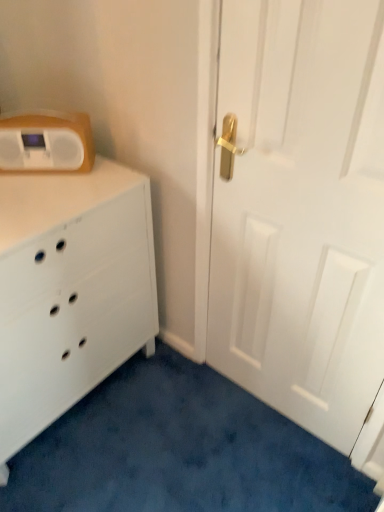
Describe the element at coordinates (70, 291) in the screenshot. I see `white matte chest of drawers at left` at that location.

What are the coordinates of `matte white radio at upper left` in the screenshot? It's located at (46, 143).

Could you tell me if matte white radio at upper left is turned towards white matte door at right?

No, matte white radio at upper left is not facing towards white matte door at right.

Is matte white radio at upper left positioned before white matte door at right?

No, it is not.

In the scene shown: Would you say matte white radio at upper left is inside or outside white matte door at right?

matte white radio at upper left exists outside the volume of white matte door at right.

Is white matte chest of drawers at left positioned before matte white radio at upper left?

Yes, white matte chest of drawers at left is in front of matte white radio at upper left.

Between white matte chest of drawers at left and matte white radio at upper left, which one has more height?

white matte chest of drawers at left.

Between white matte chest of drawers at left and matte white radio at upper left, which one has larger width?

With larger width is white matte chest of drawers at left.

Consider the image. Which object is positioned more to the left, white matte chest of drawers at left or matte white radio at upper left?

From the viewer's perspective, white matte chest of drawers at left appears more on the left side.

Are white matte door at right and white matte chest of drawers at left making contact?

white matte door at right is not next to white matte chest of drawers at left, and they're not touching.

Considering the relative positions of white matte door at right and white matte chest of drawers at left in the image provided, is white matte door at right to the right of white matte chest of drawers at left from the viewer's perspective?

Indeed, white matte door at right is positioned on the right side of white matte chest of drawers at left.

In the scene shown: How distant is white matte door at right from white matte chest of drawers at left?

51.50 centimeters.

Can you confirm if white matte door at right is thinner than white matte chest of drawers at left?

Yes, white matte door at right is thinner than white matte chest of drawers at left.

How many degrees apart are the facing directions of white matte door at right and matte white radio at upper left?

They differ by 40.9 degrees in their facing directions.

Is white matte door at right facing towards matte white radio at upper left?

No, white matte door at right is not turned towards matte white radio at upper left.

From a real-world perspective, is white matte door at right under matte white radio at upper left?

Yes, from a real-world perspective, white matte door at right is beneath matte white radio at upper left.

Where is `appliance lying behind the white matte door at right`? appliance lying behind the white matte door at right is located at coordinates (46, 143).

From the image's perspective, between matte white radio at upper left and white matte chest of drawers at left, which one is located above?

matte white radio at upper left is shown above in the image.

Does point (61, 145) come closer to viewer compared to point (43, 216)?

No.

Can you confirm if matte white radio at upper left is wider than white matte chest of drawers at left?

No.

Which is behind, matte white radio at upper left or white matte chest of drawers at left?

matte white radio at upper left is more distant.

From the image's perspective, would you say white matte chest of drawers at left is positioned over white matte door at right?

No, from the image's perspective, white matte chest of drawers at left is not over white matte door at right.

Considering the sizes of objects white matte chest of drawers at left and white matte door at right in the image provided, who is shorter, white matte chest of drawers at left or white matte door at right?

With less height is white matte chest of drawers at left.

What's the angular difference between white matte chest of drawers at left and white matte door at right's facing directions?

The angle between the facing direction of white matte chest of drawers at left and the facing direction of white matte door at right is 89.9 degrees.

Does white matte chest of drawers at left contain white matte door at right?

No, white matte door at right is not a part of white matte chest of drawers at left.

At what (x,y) coordinates should I click in order to perform the action: click on door directly beneath the matte white radio at upper left (from a real-world perspective). Please return your answer as a coordinate pair (x, y). The height and width of the screenshot is (512, 384). Looking at the image, I should click on (307, 223).

Locate an element on the screen. chest of drawers in front of the matte white radio at upper left is located at coordinates (70, 291).

Considering their positions, is matte white radio at upper left positioned further to white matte door at right than white matte chest of drawers at left?

matte white radio at upper left is positioned further to the anchor white matte door at right.

Considering their positions, is white matte chest of drawers at left positioned closer to matte white radio at upper left than white matte door at right?

white matte chest of drawers at left.

Which object lies nearer to the anchor point white matte chest of drawers at left, matte white radio at upper left or white matte door at right?

matte white radio at upper left is positioned closer to the anchor white matte chest of drawers at left.

From the image, which object appears to be nearer to matte white radio at upper left, white matte door at right or white matte chest of drawers at left?

The object closer to matte white radio at upper left is white matte chest of drawers at left.

Estimate the real-world distances between objects in this image. Which object is closer to white matte door at right, white matte chest of drawers at left or matte white radio at upper left?

white matte chest of drawers at left.

Estimate the real-world distances between objects in this image. Which object is closer to white matte chest of drawers at left, white matte door at right or matte white radio at upper left?

matte white radio at upper left is positioned closer to the anchor white matte chest of drawers at left.

Where is `appliance situated between white matte chest of drawers at left and white matte door at right from left to right`? appliance situated between white matte chest of drawers at left and white matte door at right from left to right is located at coordinates (46, 143).